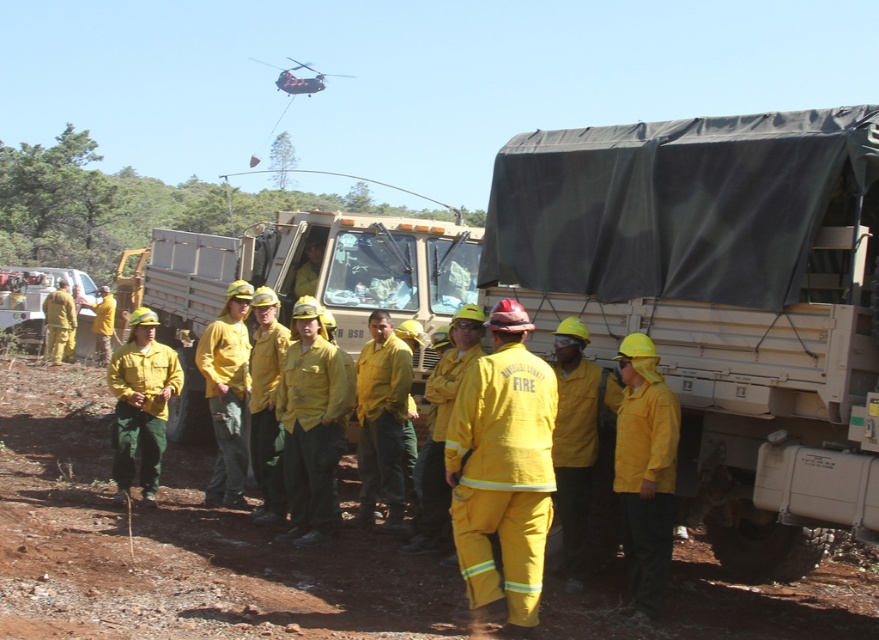
You are a photographer trying to capture a clear shot of the yellow matte uniform at center and the black matte helicopter at upper center. Since you want both subjects in focus, which one should you prioritize focusing on first?

The yellow matte uniform at center is closer to the viewer than the black matte helicopter at upper center. To ensure both are in focus, you should focus on the yellow matte uniform at center first, as focusing on closer objects allows the background to be in better focus when using depth of field techniques.

Consider the image. You are a photographer trying to capture both the yellow matte fire jacket at center and the black matte helicopter at upper center in the same frame. Which object should you focus on first to ensure both are in the frame?

The yellow matte fire jacket at center is not as tall as the black matte helicopter at upper center, so you should focus on the black matte helicopter at upper center first to ensure both are in the frame.

You are a photographer trying to capture a clear photo of the yellow matte fire jacket at center and the black matte helicopter at upper center. Since you want both subjects to be in focus, you need to know which one is narrower. Which object is narrower?

The yellow matte fire jacket at center is narrower than the black matte helicopter at upper center.